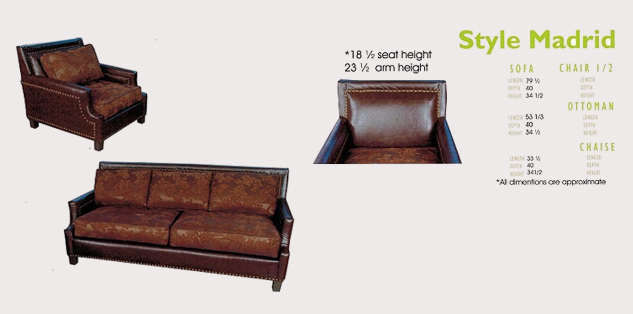
Identify the location of light beige background. The width and height of the screenshot is (633, 314). (195, 53).